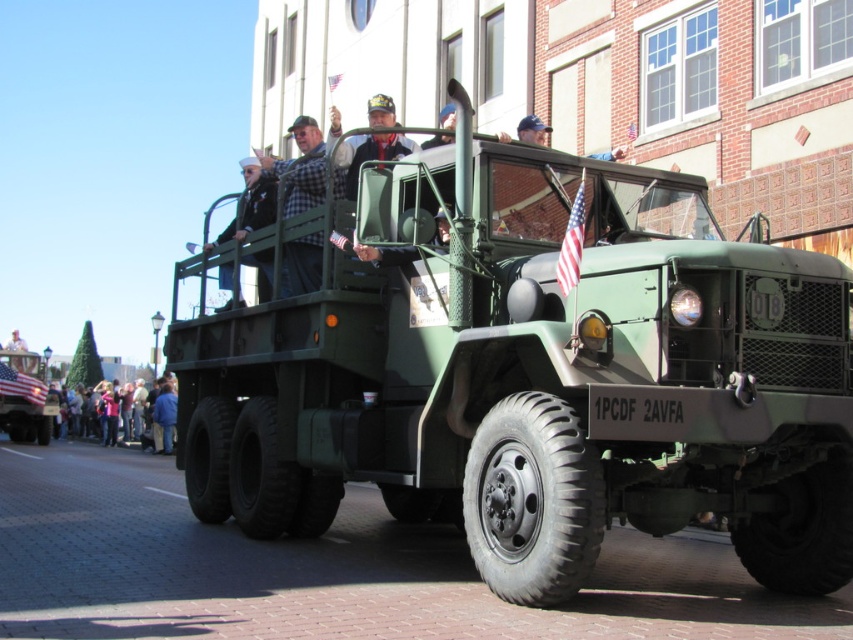
Is checkered fabric shirt at center shorter than matte black jeep at lower left?

Yes, checkered fabric shirt at center is shorter than matte black jeep at lower left.

Measure the distance between checkered fabric shirt at center and matte black jeep at lower left.

checkered fabric shirt at center and matte black jeep at lower left are 22.15 meters apart from each other.

Find the location of a particular element. The image size is (853, 640). checkered fabric shirt at center is located at coordinates (300, 168).

Where is `checkered fabric shirt at center`? The height and width of the screenshot is (640, 853). checkered fabric shirt at center is located at coordinates (300, 168).

Does checkered fabric shirt at center come behind blue denim jacket at lower left?

No, checkered fabric shirt at center is in front of blue denim jacket at lower left.

Measure the distance between checkered fabric shirt at center and camera.

They are 8.97 meters apart.

Where is `checkered fabric shirt at center`? This screenshot has width=853, height=640. checkered fabric shirt at center is located at coordinates (300, 168).

Which is above, matte black jeep at lower left or blue denim jacket at lower left?

matte black jeep at lower left is above.

Is matte black jeep at lower left above blue denim jacket at lower left?

Correct, matte black jeep at lower left is located above blue denim jacket at lower left.

Is point (1, 394) farther from camera compared to point (146, 397)?

No, (1, 394) is closer to viewer.

Where is `matte black jeep at lower left`? The height and width of the screenshot is (640, 853). matte black jeep at lower left is located at coordinates (28, 417).